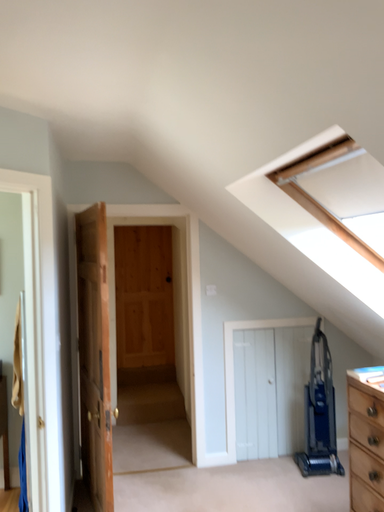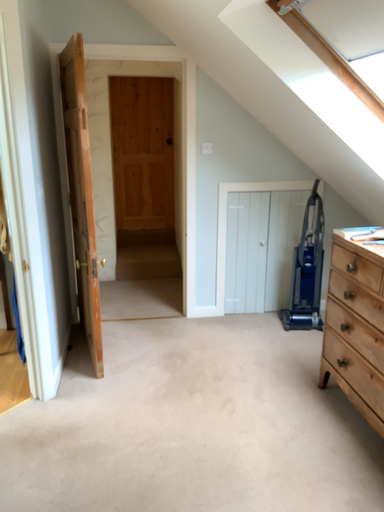
Question: How did the camera likely rotate when shooting the video?

Choices:
 (A) rotated upward
 (B) rotated downward

Answer: (B)